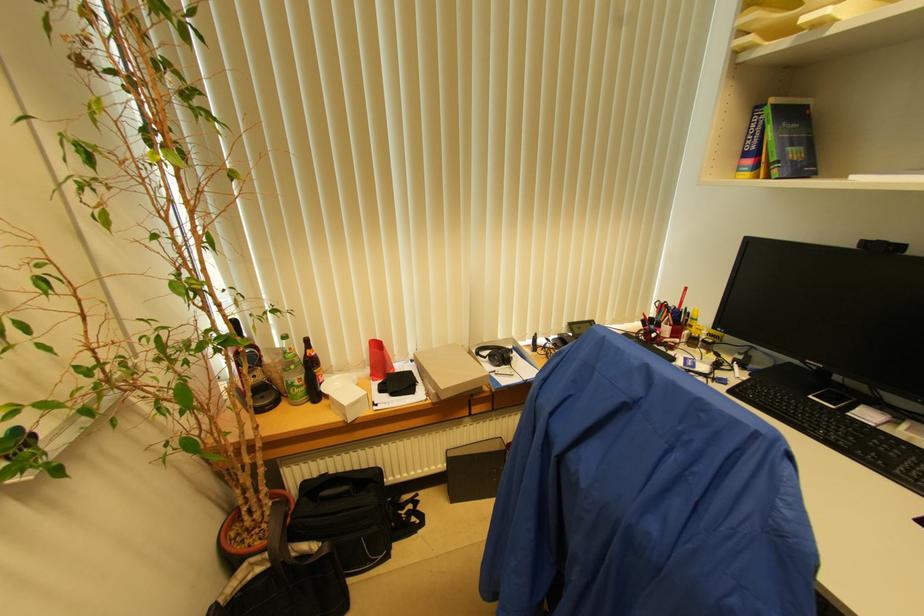
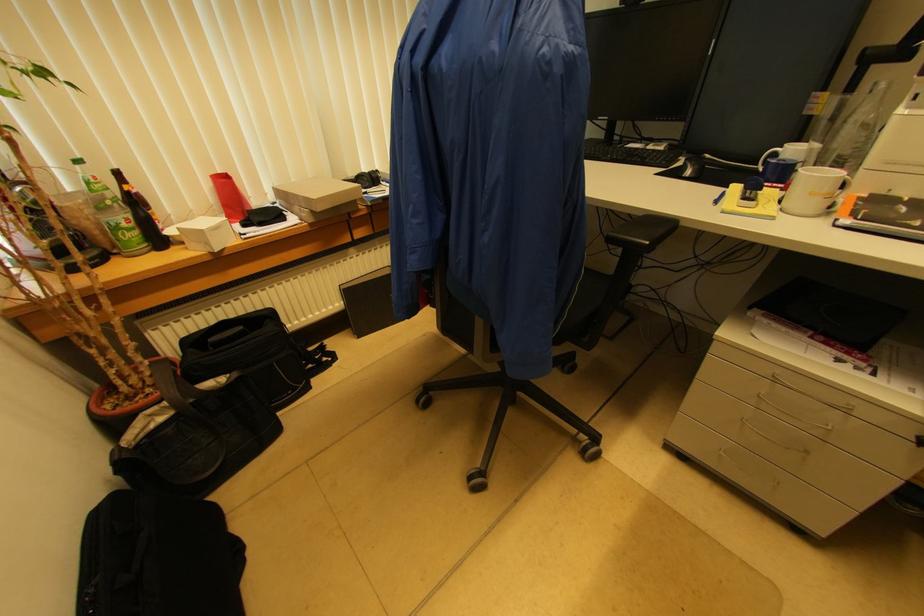
Locate, in the second image, the point that corresponds to [444,389] in the first image.

(315, 200)